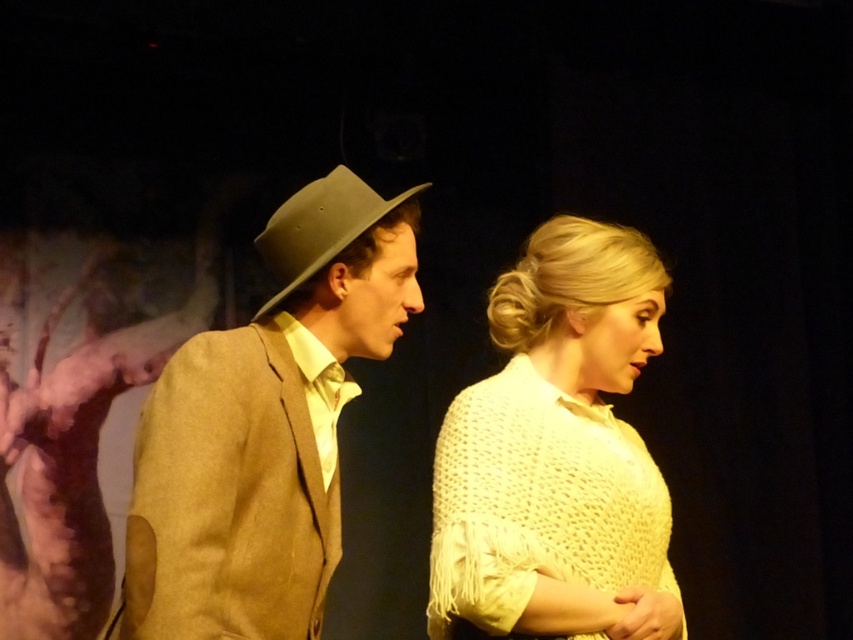
Is white knitted shawl at center to the right of matte brown hat at center from the viewer's perspective?

Correct, you'll find white knitted shawl at center to the right of matte brown hat at center.

Who is higher up, white knitted shawl at center or matte brown hat at center?

matte brown hat at center is above.

Who is more forward, (589, 292) or (337, 244)?

Positioned in front is point (337, 244).

You are a GUI agent. You are given a task and a screenshot of the screen. Output one action in this format:
    pyautogui.click(x=<x>, y=<y>)
    Task: Click on the white knitted shawl at center
    This screenshot has width=853, height=640.
    Given the screenshot: What is the action you would take?
    pyautogui.click(x=556, y=452)

Is matte brown suit at left to the left of matte brown hat at center from the viewer's perspective?

Yes, matte brown suit at left is to the left of matte brown hat at center.

Does matte brown suit at left have a smaller size compared to matte brown hat at center?

Incorrect, matte brown suit at left is not smaller in size than matte brown hat at center.

Is point (302, 614) more distant than point (277, 298)?

That is False.

At what (x,y) coordinates should I click in order to perform the action: click on matte brown suit at left. Please return your answer as a coordinate pair (x, y). The image size is (853, 640). Looking at the image, I should click on (265, 428).

Who is higher up, matte brown suit at left or white knitted shawl at center?

matte brown suit at left

Between matte brown suit at left and white knitted shawl at center, which one has less height?

matte brown suit at left

This screenshot has height=640, width=853. Identify the location of matte brown suit at left. (265, 428).